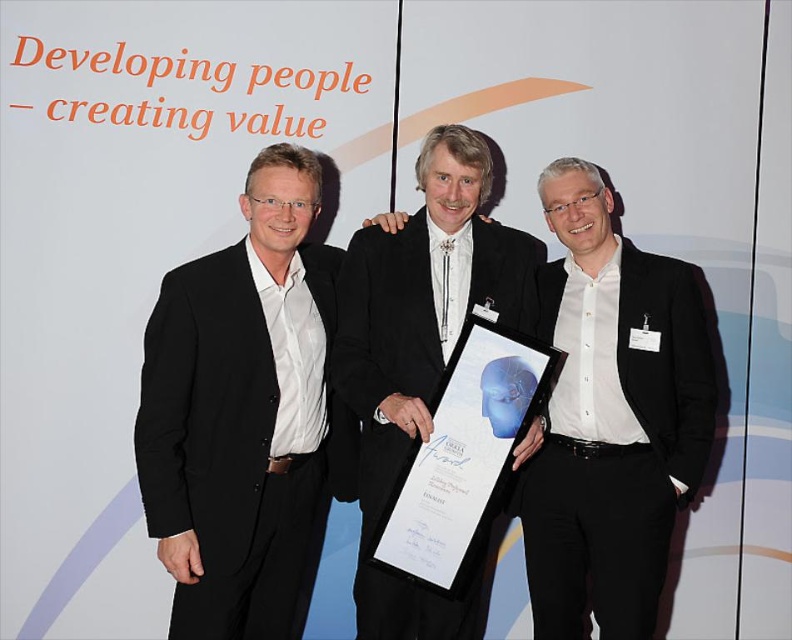
Is matte black suit at left above white glossy shirt at center?

Incorrect, matte black suit at left is not positioned above white glossy shirt at center.

From the picture: Is matte black suit at left positioned at the back of white glossy shirt at center?

No, matte black suit at left is in front of white glossy shirt at center.

Find the location of a particular element. matte black suit at left is located at coordinates (244, 413).

Is white glossy shirt at center taller than black satin suit at center?

Incorrect, white glossy shirt at center's height is not larger of black satin suit at center's.

Between point (699, 451) and point (478, 161), which one is positioned in front?

Point (478, 161) is more forward.

Locate an element on the screen. The width and height of the screenshot is (792, 640). white glossy shirt at center is located at coordinates 612,419.

Consider the image. Can you confirm if matte black suit at left is positioned to the left of black satin suit at center?

Correct, you'll find matte black suit at left to the left of black satin suit at center.

Who is positioned more to the left, matte black suit at left or black satin suit at center?

Positioned to the left is matte black suit at left.

Is point (240, 362) behind point (358, 392)?

That is False.

This screenshot has width=792, height=640. Find the location of `matte black suit at left`. matte black suit at left is located at coordinates (244, 413).